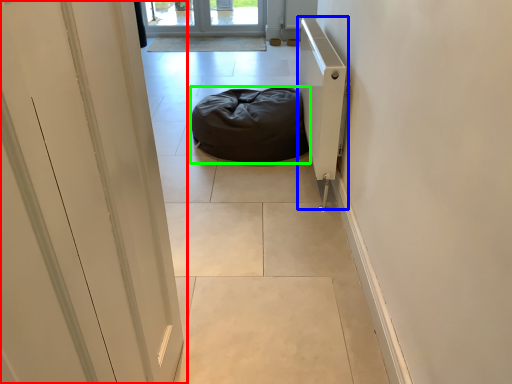
Question: Based on their relative distances, which object is farther from door (highlighted by a red box)? Choose from radiator (highlighted by a blue box) and furniture (highlighted by a green box).

Choices:
 (A) radiator
 (B) furniture

Answer: (B)